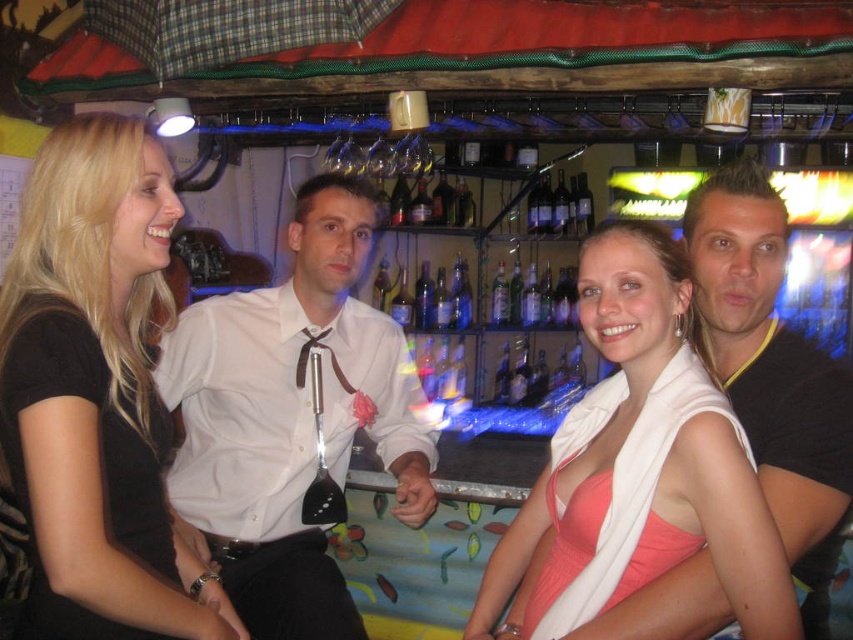
Question: Can you confirm if white satin shirt at center is positioned to the right of translucent glass bottles at center?

Choices:
 (A) no
 (B) yes

Answer: (A)

Question: Which of the following is the closest to the observer?

Choices:
 (A) (495, 618)
 (B) (579, 179)

Answer: (A)

Question: Which of the following is the farthest from the observer?

Choices:
 (A) (543, 221)
 (B) (306, 336)
 (C) (250, 506)

Answer: (A)

Question: Does pink satin dress at center have a smaller size compared to brown satin tie at center?

Choices:
 (A) no
 (B) yes

Answer: (A)

Question: Does black matte shirt at left have a smaller size compared to pink satin dress at center?

Choices:
 (A) no
 (B) yes

Answer: (B)

Question: Which point is farther to the camera?

Choices:
 (A) pink satin dress at center
 (B) slick black hair at right

Answer: (B)